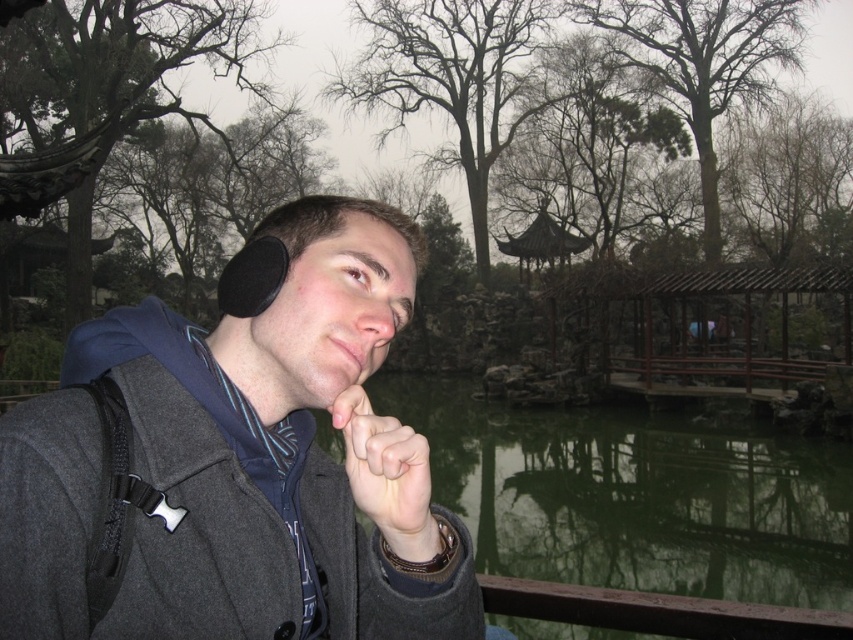
You are a photographer trying to capture the exact location of the skinny white hand at center in the image. According to the coordinates provided, where should you focus your camera lens to ensure the hand is centered in the frame?

To center the skinny white hand at center in the frame, focus your camera lens at the coordinates point (x=386, y=470) as that is where the hand is located.

You are a fashion designer observing the scene and want to compare the length of the dark gray wool jacket at center with the green reflective water at center. Which one has a greater height?

The green reflective water at center has a greater height than the dark gray wool jacket at center because the dark gray wool jacket at center is shorter than green reflective water at center.